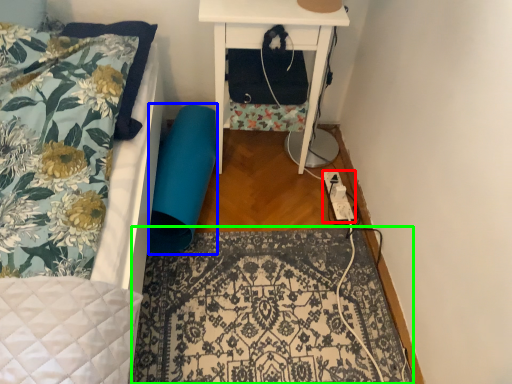
Question: Based on their relative distances, which object is farther from extension cord (highlighted by a red box)? Choose from swivel chair (highlighted by a blue box) and mat (highlighted by a green box).

Choices:
 (A) swivel chair
 (B) mat

Answer: (A)